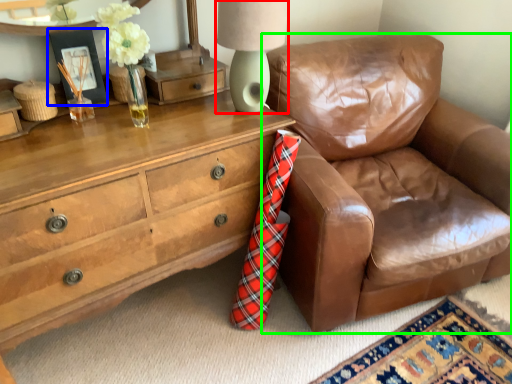
Question: Considering the real-world distances, which object is closest to table lamp (highlighted by a red box)? picture frame (highlighted by a blue box) or chair (highlighted by a green box).

Choices:
 (A) picture frame
 (B) chair

Answer: (A)